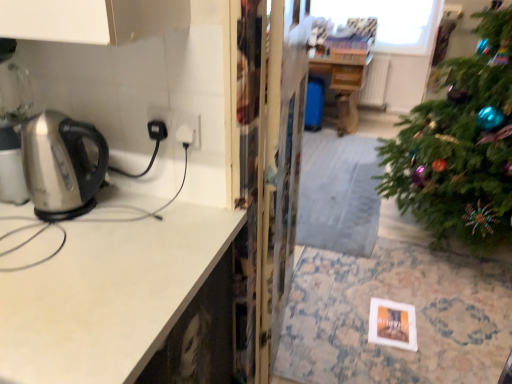
Question: Considering the positions of metallic stainless steel kettle at left and satin white countertop at left in the image, is metallic stainless steel kettle at left taller or shorter than satin white countertop at left?

Choices:
 (A) short
 (B) tall

Answer: (B)

Question: Considering the positions of point (173, 54) and point (88, 284), is point (173, 54) closer or farther from the camera than point (88, 284)?

Choices:
 (A) farther
 (B) closer

Answer: (A)

Question: Which object is positioned closest to the metallic stainless steel kettle at left?

Choices:
 (A) transparent plastic screen door at center
 (B) satin white countertop at left
 (C) wooden table at center

Answer: (B)

Question: Which of these objects is positioned closest to the transparent plastic screen door at center?

Choices:
 (A) wooden table at center
 (B) satin white countertop at left
 (C) metallic stainless steel kettle at left

Answer: (C)